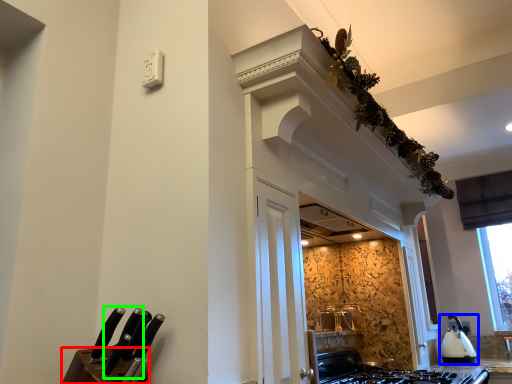
Question: Which object is positioned farthest from cabinetry (highlighted by a red box)? Select from kitchen appliance (highlighted by a blue box) and knife (highlighted by a green box).

Choices:
 (A) kitchen appliance
 (B) knife

Answer: (A)